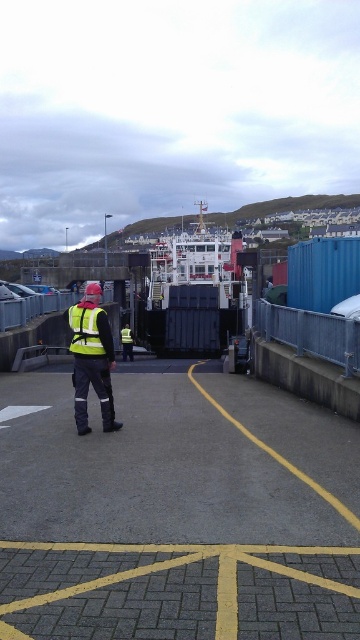
Question: Which point is closer to the camera?

Choices:
 (A) high visibility vest at center
 (B) high-visibility fabric safety vest at center

Answer: (A)

Question: Is high visibility vest at center bigger than high-visibility fabric safety vest at center?

Choices:
 (A) yes
 (B) no

Answer: (A)

Question: Can you confirm if high visibility vest at center is bigger than high-visibility fabric safety vest at center?

Choices:
 (A) no
 (B) yes

Answer: (B)

Question: Does high visibility vest at center appear on the left side of high-visibility fabric safety vest at center?

Choices:
 (A) yes
 (B) no

Answer: (A)